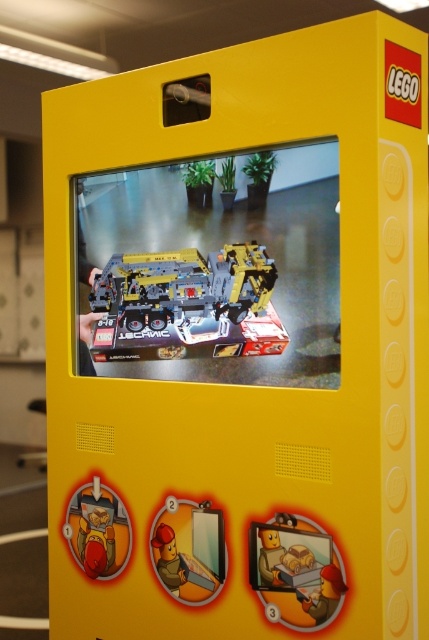
This screenshot has height=640, width=429. What do you see at coordinates (187, 304) in the screenshot? I see `yellow plastic lego set at center` at bounding box center [187, 304].

Between yellow plastic lego set at center and matte yellow minifigure at bottom right, which one appears on the right side from the viewer's perspective?

matte yellow minifigure at bottom right is more to the right.

Image resolution: width=429 pixels, height=640 pixels. Identify the location of yellow plastic lego set at center. (187, 304).